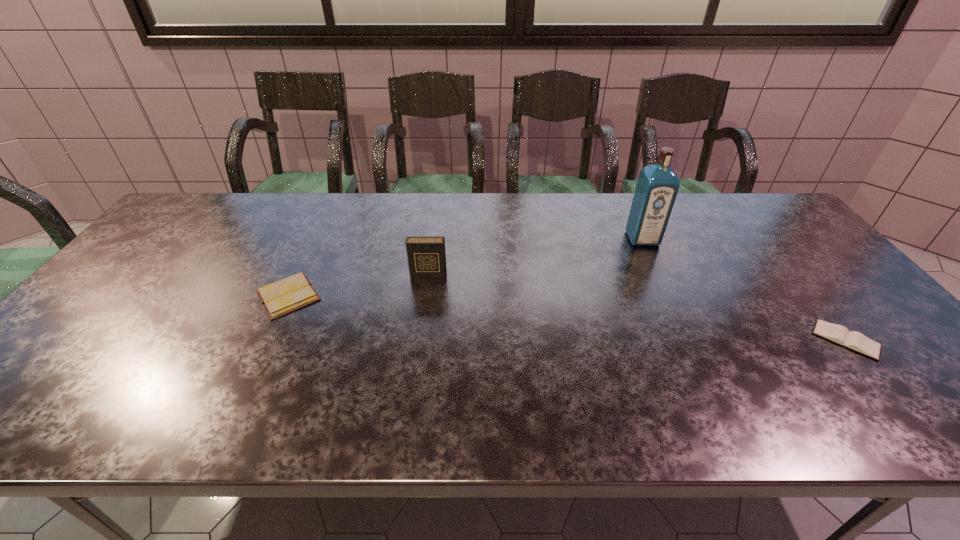
Where is `free space that is in between the liquor and the rightmost diary`? This screenshot has width=960, height=540. free space that is in between the liquor and the rightmost diary is located at coordinates (744, 289).

Find the location of a particular element. vacant area between the leftmost diary and the farthest object is located at coordinates (466, 267).

You are a GUI agent. You are given a task and a screenshot of the screen. Output one action in this format:
    pyautogui.click(x=<x>, y=<y>)
    Task: Click on the empty space between the rightmost diary and the third object from left to right
    The image size is (960, 540).
    Given the screenshot: What is the action you would take?
    pyautogui.click(x=744, y=289)

This screenshot has height=540, width=960. Find the location of `vacant area that lies between the leftmost diary and the rightmost object`. vacant area that lies between the leftmost diary and the rightmost object is located at coordinates (567, 318).

Find the location of `vacant area that lies between the leftmost object and the second object from left to right`. vacant area that lies between the leftmost object and the second object from left to right is located at coordinates (358, 287).

The image size is (960, 540). I want to click on free space between the leftmost object and the liquor, so click(466, 267).

Image resolution: width=960 pixels, height=540 pixels. Identify the location of vacant area that lies between the second diary from right to left and the rightmost object. [637, 309].

This screenshot has height=540, width=960. I want to click on vacant space that's between the rightmost diary and the second object from left to right, so click(637, 309).

Locate an element on the screen. The height and width of the screenshot is (540, 960). the closest object to the rightmost diary is located at coordinates (657, 186).

Select which object appears as the third closest to the rightmost diary. Please provide its 2D coordinates. Your answer should be formatted as a tuple, i.e. [(x, y)], where the tuple contains the x and y coordinates of a point satisfying the conditions above.

[(286, 295)]